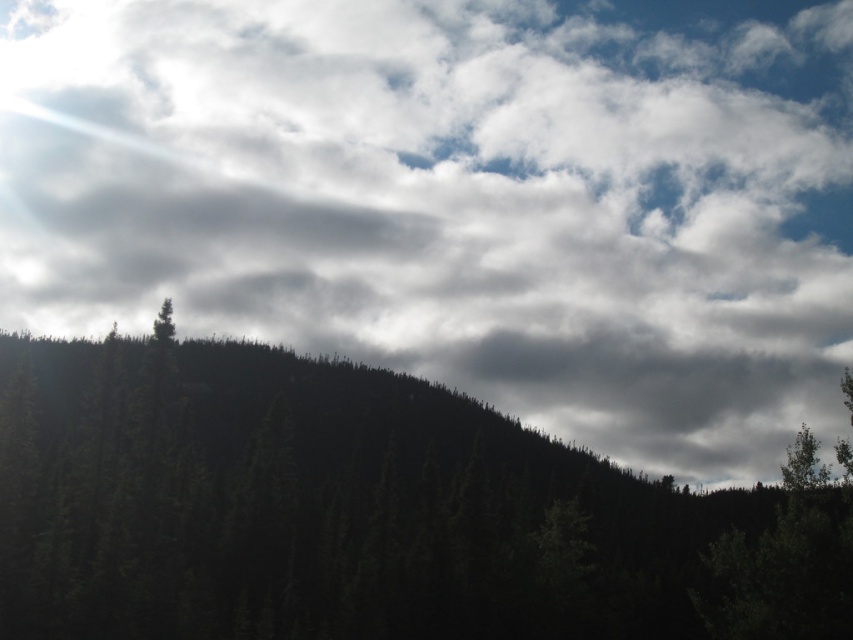
Question: Is green matte tree at lower right below green matte tree at upper left?

Choices:
 (A) yes
 (B) no

Answer: (A)

Question: Observing the image, what is the correct spatial positioning of green matte tree at lower right in reference to green matte tree at upper left?

Choices:
 (A) above
 (B) below

Answer: (B)

Question: Which point is farther to the camera?

Choices:
 (A) green matte tree at lower right
 (B) green matte tree at upper left
 (C) dark green textured trees at center

Answer: (B)

Question: From the image, what is the correct spatial relationship of dark green textured trees at center in relation to green matte tree at upper left?

Choices:
 (A) right
 (B) left

Answer: (A)

Question: Among these points, which one is nearest to the camera?

Choices:
 (A) (219, 353)
 (B) (802, 468)
 (C) (163, 340)

Answer: (B)

Question: Which point is closer to the camera taking this photo?

Choices:
 (A) (51, 404)
 (B) (164, 316)
 (C) (820, 477)

Answer: (C)